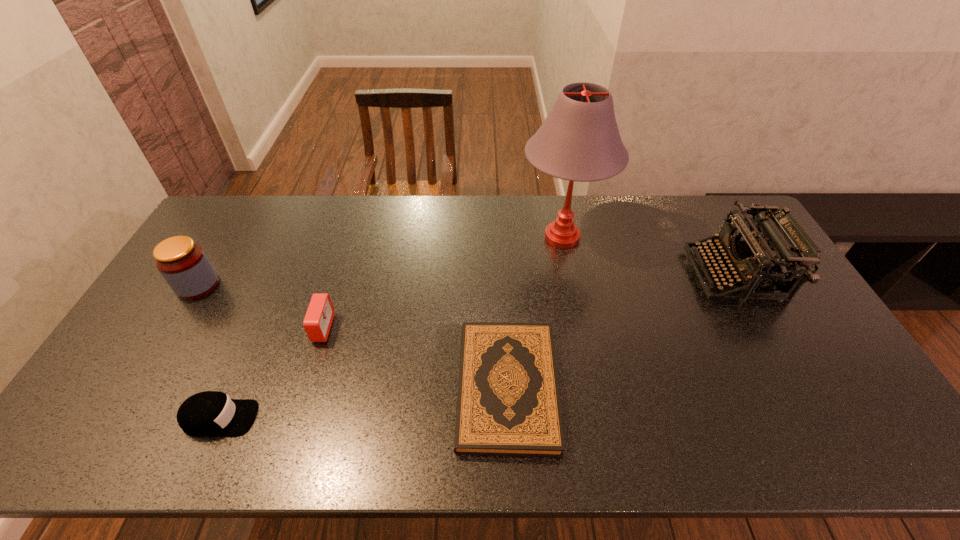
I want to click on hardback book present at the near edge, so click(x=508, y=404).

In order to click on object that is at the left edge in this screenshot , I will do click(184, 265).

This screenshot has height=540, width=960. Identify the location of object situated at the right edge. [773, 237].

In the image, there is a desktop. In order to click on vacant space at the far edge in this screenshot , I will do `click(308, 217)`.

The image size is (960, 540). What are the coordinates of `vacant space at the near edge of the desktop` in the screenshot? It's located at (396, 424).

The image size is (960, 540). Identify the location of free space at the right edge of the desktop. (880, 419).

Where is `vacant space at the far right corner of the desktop`? Image resolution: width=960 pixels, height=540 pixels. vacant space at the far right corner of the desktop is located at coordinates (728, 209).

This screenshot has width=960, height=540. I want to click on free space between the leftmost object and the table lamp, so click(380, 261).

Identify the location of unoccupied position between the tallest object and the leftmost object. (380, 261).

Where is `vacant space in between the fourth shortest object and the hardback book`? This screenshot has height=540, width=960. vacant space in between the fourth shortest object and the hardback book is located at coordinates (352, 336).